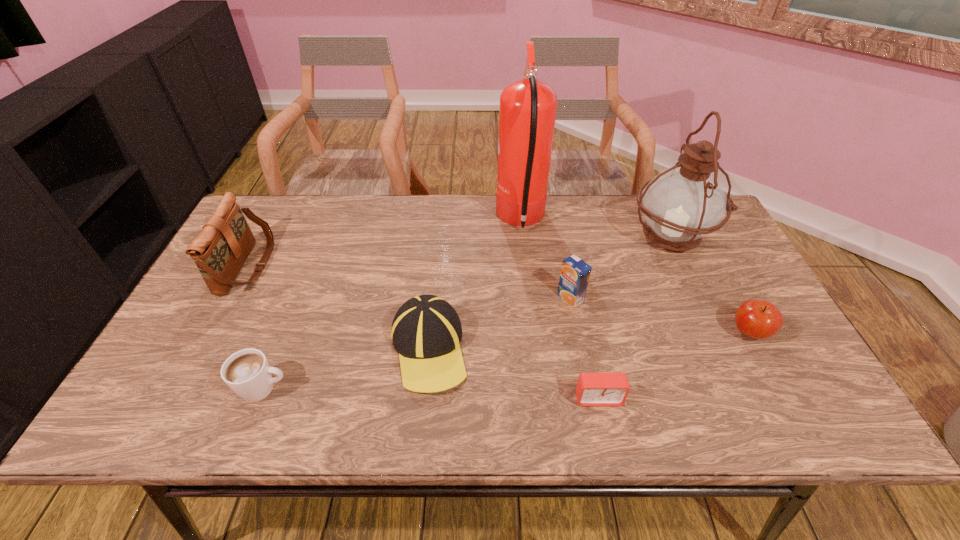
This screenshot has height=540, width=960. I want to click on free space located 0.140m towards the nozzle of the tallest object, so click(x=452, y=220).

At what (x,y) coordinates should I click in order to perform the action: click on vacant area located towards the nozzle of the tallest object. Please return your answer as a coordinate pair (x, y). The image size is (960, 540). Looking at the image, I should click on (462, 220).

Locate an element on the screen. The width and height of the screenshot is (960, 540). vacant space located 0.200m on the front of the oil lamp is located at coordinates (712, 322).

Find the location of a particular element. The width and height of the screenshot is (960, 540). blank space located on the front-facing side of the leftmost object is located at coordinates (301, 266).

Locate an element on the screen. This screenshot has width=960, height=540. free region located 0.090m on the left of the orange_juice is located at coordinates (523, 298).

The height and width of the screenshot is (540, 960). Find the location of `free space located with the brim of the baseball cap facing forward`. free space located with the brim of the baseball cap facing forward is located at coordinates (420, 428).

The width and height of the screenshot is (960, 540). Find the location of `vacant space located on the back of the apple`. vacant space located on the back of the apple is located at coordinates (707, 254).

This screenshot has height=540, width=960. What are the coordinates of `free point located with the handle on the side of the cappuccino` in the screenshot? It's located at (444, 389).

Locate an element on the screen. The image size is (960, 540). fire extinguisher at the far edge is located at coordinates (527, 111).

Find the location of a particular element. oil lamp that is at the far edge is located at coordinates (680, 205).